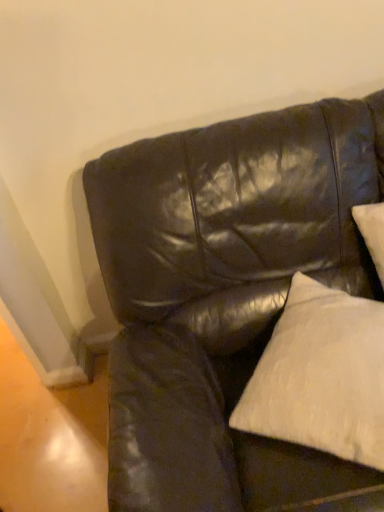
Question: Should I look upward or downward to see glossy leather couch at upper right?

Choices:
 (A) down
 (B) up

Answer: (A)

Question: Can you confirm if white cotton pillow at upper right is positioned to the left of glossy leather couch at upper right?

Choices:
 (A) yes
 (B) no

Answer: (B)

Question: Is white cotton pillow at upper right beside glossy leather couch at upper right?

Choices:
 (A) no
 (B) yes

Answer: (A)

Question: From the image's perspective, is white cotton pillow at upper right below glossy leather couch at upper right?

Choices:
 (A) no
 (B) yes

Answer: (A)

Question: Does white cotton pillow at upper right lie in front of glossy leather couch at upper right?

Choices:
 (A) no
 (B) yes

Answer: (A)

Question: Can you confirm if white cotton pillow at upper right is thinner than glossy leather couch at upper right?

Choices:
 (A) yes
 (B) no

Answer: (A)

Question: From the image's perspective, does white cotton pillow at upper right appear higher than glossy leather couch at upper right?

Choices:
 (A) yes
 (B) no

Answer: (A)

Question: From the image's perspective, is glossy leather couch at upper right above white cotton pillow at upper right?

Choices:
 (A) yes
 (B) no

Answer: (B)

Question: From a real-world perspective, is glossy leather couch at upper right beneath white cotton pillow at upper right?

Choices:
 (A) yes
 (B) no

Answer: (A)

Question: Is glossy leather couch at upper right oriented towards white cotton pillow at upper right?

Choices:
 (A) yes
 (B) no

Answer: (A)

Question: Is glossy leather couch at upper right not near white cotton pillow at upper right?

Choices:
 (A) yes
 (B) no

Answer: (B)

Question: Considering the relative positions of glossy leather couch at upper right and white cotton pillow at upper right in the image provided, is glossy leather couch at upper right to the right of white cotton pillow at upper right from the viewer's perspective?

Choices:
 (A) no
 (B) yes

Answer: (A)

Question: Is glossy leather couch at upper right surrounding white cotton pillow at upper right?

Choices:
 (A) yes
 (B) no

Answer: (A)

Question: Considering the positions of glossy leather couch at upper right and white cotton pillow at upper right in the image, is glossy leather couch at upper right bigger or smaller than white cotton pillow at upper right?

Choices:
 (A) small
 (B) big

Answer: (B)